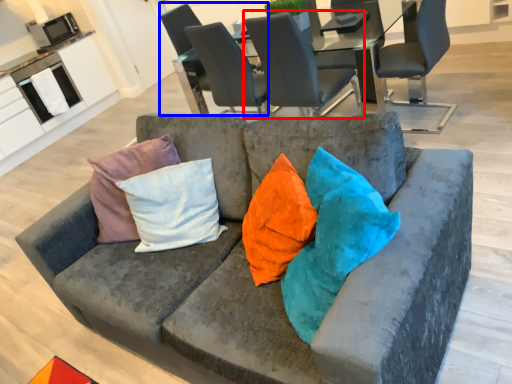
Question: Which object appears farthest to the camera in this image, chair (highlighted by a red box) or chair (highlighted by a blue box)?

Choices:
 (A) chair
 (B) chair

Answer: (B)